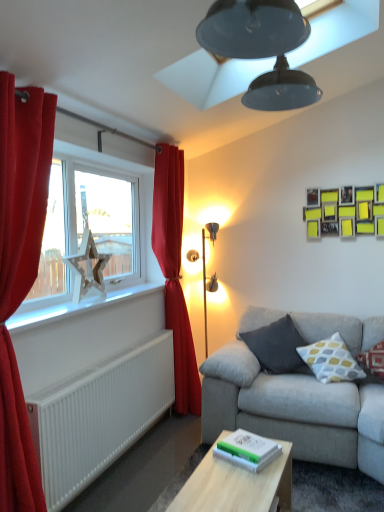
Locate an element on the screen. This screenshot has height=512, width=384. wooden star at left is located at coordinates (93, 218).

The width and height of the screenshot is (384, 512). What do you see at coordinates (99, 416) in the screenshot?
I see `white textured radiator at lower left` at bounding box center [99, 416].

You are a GUI agent. You are given a task and a screenshot of the screen. Output one action in this format:
    pyautogui.click(x=<x>, y=<y>)
    Task: Click on the dark gray cushion at center, which ranks as the 1th pillow in left-to-right order
    
    Given the screenshot: What is the action you would take?
    pyautogui.click(x=277, y=347)

How much space does dark gray cushion at center, which ranks as the 1th pillow in left-to-right order, occupy vertically?

17.67 inches.

Image resolution: width=384 pixels, height=512 pixels. I want to click on velvet red curtain at left, the 1th curtain in the left-to-right sequence, so click(x=20, y=272).

Image resolution: width=384 pixels, height=512 pixels. I want to click on wooden star at left, so click(x=93, y=218).

In the image, is red velvet curtain at left, which appears as the 1th curtain when viewed from the back, positioned in front of or behind yellow-grey dotted cushion at right, which is the 2th pillow from right to left?

Clearly, red velvet curtain at left, which appears as the 1th curtain when viewed from the back, is behind yellow-grey dotted cushion at right, which is the 2th pillow from right to left.

Is red velvet curtain at left, positioned as the 2th curtain in left-to-right order, facing towards yellow-grey dotted cushion at right, which is the 2th pillow from right to left?

Yes.

From a real-world perspective, is red velvet curtain at left, the 1th curtain when ordered from right to left, over yellow-grey dotted cushion at right, the second pillow from the left?

Yes, from a real-world perspective, red velvet curtain at left, the 1th curtain when ordered from right to left, is over yellow-grey dotted cushion at right, the second pillow from the left

Is point (167, 273) more distant than point (338, 349)?

Yes.

Is dark gray cushion at center, the third pillow when ordered from right to left, wider than white plastic window sill at left?

Yes.

From a real-world perspective, is dark gray cushion at center, the third pillow when ordered from right to left, on top of white plastic window sill at left?

No, from a real-world perspective, dark gray cushion at center, the third pillow when ordered from right to left, is not on top of white plastic window sill at left.

Is dark gray cushion at center, the third pillow when ordered from right to left, next to white plastic window sill at left and touching it?

No, dark gray cushion at center, the third pillow when ordered from right to left, is not beside white plastic window sill at left.

In the scene shown: Which is more to the right, dark gray cushion at center, the third pillow when ordered from right to left, or wooden star at left?

Positioned to the right is dark gray cushion at center, the third pillow when ordered from right to left.

Which of these two, dark gray cushion at center, which ranks as the 1th pillow in left-to-right order, or wooden star at left, is smaller?

wooden star at left is smaller.

From a real-world perspective, between dark gray cushion at center, the third pillow when ordered from right to left, and wooden star at left, who is vertically lower?

dark gray cushion at center, the third pillow when ordered from right to left, from a real-world perspective.

Based on the photo, is there a large distance between white textured radiator at lower left and gold metallic floor lamp at center?

Yes, white textured radiator at lower left and gold metallic floor lamp at center are quite far apart.

Who is more distant, white textured radiator at lower left or gold metallic floor lamp at center?

gold metallic floor lamp at center is further from the camera.

Between white textured radiator at lower left and gold metallic floor lamp at center, which one has more height?

gold metallic floor lamp at center is taller.

This screenshot has height=512, width=384. In order to click on radiator below the gold metallic floor lamp at center (from a real-world perspective) in this screenshot , I will do `click(99, 416)`.

Which of these two, light wood rectangular table at center or gold metallic floor lamp at center, stands taller?

gold metallic floor lamp at center is taller.

From a real-world perspective, is light wood rectangular table at center under gold metallic floor lamp at center?

Yes.

Where is `table directly beneath the gold metallic floor lamp at center (from a real-world perspective)`? Image resolution: width=384 pixels, height=512 pixels. table directly beneath the gold metallic floor lamp at center (from a real-world perspective) is located at coordinates (235, 485).

Which object is positioned more to the left, light wood rectangular table at center or gold metallic floor lamp at center?

From the viewer's perspective, gold metallic floor lamp at center appears more on the left side.

Does gold metallic floor lamp at center lie in front of red velvet curtain at left, the 1th curtain when ordered from right to left?

No, the depth of gold metallic floor lamp at center is greater than that of red velvet curtain at left, the 1th curtain when ordered from right to left.

How many degrees apart are the facing directions of gold metallic floor lamp at center and red velvet curtain at left, positioned as the 2th curtain in left-to-right order?

The facing directions of gold metallic floor lamp at center and red velvet curtain at left, positioned as the 2th curtain in left-to-right order, are 1.81 degrees apart.

In terms of height, does gold metallic floor lamp at center look taller or shorter compared to red velvet curtain at left, the 1th curtain when ordered from right to left?

Clearly, gold metallic floor lamp at center is shorter compared to red velvet curtain at left, the 1th curtain when ordered from right to left.

How far apart are gold metallic floor lamp at center and red velvet curtain at left, positioned as the 2th curtain in left-to-right order?

gold metallic floor lamp at center is 24.39 inches from red velvet curtain at left, positioned as the 2th curtain in left-to-right order.

Is gold metallic floor lamp at center touching yellow-grey dotted cushion at right, the second pillow from the left?

They are not placed beside each other.

Would you say gold metallic floor lamp at center is to the left or to the right of yellow-grey dotted cushion at right, the second pillow from the left, in the picture?

gold metallic floor lamp at center is to the left of yellow-grey dotted cushion at right, the second pillow from the left.

From the image's perspective, is gold metallic floor lamp at center above or below yellow-grey dotted cushion at right, which is the 2th pillow from right to left?

Clearly, from the image's perspective, gold metallic floor lamp at center is above yellow-grey dotted cushion at right, which is the 2th pillow from right to left.

Is gold metallic floor lamp at center taller than yellow-grey dotted cushion at right, which is the 2th pillow from right to left?

Correct, gold metallic floor lamp at center is much taller as yellow-grey dotted cushion at right, which is the 2th pillow from right to left.

Identify the location of curtain behind the yellow-grey dotted cushion at right, which is the 2th pillow from right to left. This screenshot has width=384, height=512. (174, 272).

From a real-world perspective, which pillow is the 3rd one underneath the white plastic window sill at left? Please provide its 2D coordinates.

[(277, 347)]

Looking at the image, which one is located closer to light wood rectangular table at center, red cotton cushion at right, positioned as the 3th pillow in left-to-right order, or white textured radiator at lower left?

Based on the image, white textured radiator at lower left appears to be nearer to light wood rectangular table at center.

When comparing their distances from yellow-grey dotted cushion at right, the second pillow from the left, does red velvet curtain at left, the 1th curtain when ordered from right to left, or white textured radiator at lower left seem further?

white textured radiator at lower left is positioned further to the anchor yellow-grey dotted cushion at right, the second pillow from the left.

Estimate the real-world distances between objects in this image. Which object is further from white textured radiator at lower left, gold metallic floor lamp at center or white plastic window sill at left?

gold metallic floor lamp at center.

Estimate the real-world distances between objects in this image. Which object is further from gold metallic floor lamp at center, dark gray cushion at center, which ranks as the 1th pillow in left-to-right order, or yellow-grey dotted cushion at right, the second pillow from the left?

yellow-grey dotted cushion at right, the second pillow from the left, lies further to gold metallic floor lamp at center than the other object.

Considering their positions, is wooden star at left positioned closer to red cotton cushion at right, positioned as the 3th pillow in left-to-right order, than light wood rectangular table at center?

light wood rectangular table at center.

Looking at this image, considering their positions, is light wood rectangular table at center positioned further to white plastic window sill at left than dark gray cushion at center, which ranks as the 1th pillow in left-to-right order?

light wood rectangular table at center is positioned further to the anchor white plastic window sill at left.

Estimate the real-world distances between objects in this image. Which object is further from velvet red curtain at left, positioned as the 2th curtain in right-to-left order, wooden star at left or white textured radiator at lower left?

wooden star at left is positioned further to the anchor velvet red curtain at left, positioned as the 2th curtain in right-to-left order.

Which object lies further to the anchor point red velvet curtain at left, positioned as the 2th curtain in left-to-right order, white textured radiator at lower left or wooden star at left?

white textured radiator at lower left is further to red velvet curtain at left, positioned as the 2th curtain in left-to-right order.

Find the location of a particular element. This screenshot has width=384, height=512. curtain between wooden star at left and gold metallic floor lamp at center along the z-axis is located at coordinates (174, 272).

Where is `curtain positioned between light wood rectangular table at center and dark gray cushion at center, which ranks as the 1th pillow in left-to-right order, from near to far`? curtain positioned between light wood rectangular table at center and dark gray cushion at center, which ranks as the 1th pillow in left-to-right order, from near to far is located at coordinates (20, 272).

Locate an element on the screen. The image size is (384, 512). radiator located between velvet red curtain at left, marked as the 1th curtain in a front-to-back arrangement, and gold metallic floor lamp at center in the depth direction is located at coordinates (99, 416).

I want to click on table between wooden star at left and yellow-grey dotted cushion at right, which is the 2th pillow from right to left, from left to right, so click(235, 485).